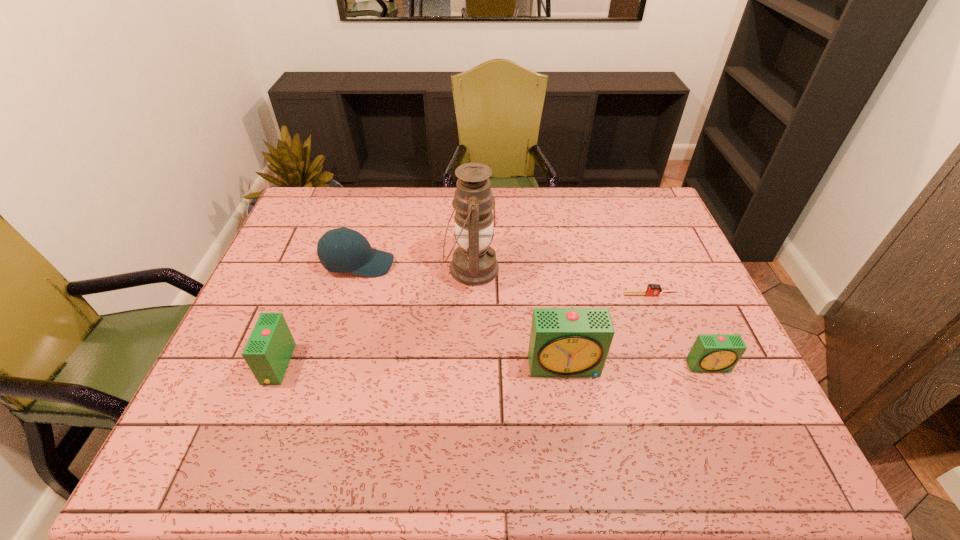
Where is `object that is at the near left corner`? This screenshot has height=540, width=960. object that is at the near left corner is located at coordinates (268, 351).

Where is `vacant area at the far edge of the desktop`? vacant area at the far edge of the desktop is located at coordinates (404, 193).

Where is `vacant space at the near edge`? The width and height of the screenshot is (960, 540). vacant space at the near edge is located at coordinates (639, 395).

Where is `blank space at the right edge of the desktop`? Image resolution: width=960 pixels, height=540 pixels. blank space at the right edge of the desktop is located at coordinates (668, 305).

Locate an element on the screen. blank space at the far right corner is located at coordinates click(645, 190).

You are a GUI agent. You are given a task and a screenshot of the screen. Output one action in this format:
    pyautogui.click(x=<x>, y=<y>)
    Task: Click on the free area in between the shortest object and the rightmost alarm clock
    This screenshot has width=960, height=540.
    Given the screenshot: What is the action you would take?
    pyautogui.click(x=680, y=330)

Locate an element on the screen. The height and width of the screenshot is (540, 960). vacant space in between the tallest object and the leftmost alarm clock is located at coordinates (374, 316).

Identify the location of free spot between the second tallest object and the baseball cap. The height and width of the screenshot is (540, 960). (462, 315).

This screenshot has width=960, height=540. In order to click on blank region between the leftmost alarm clock and the baseball cap in this screenshot , I will do `click(318, 314)`.

Where is `free space between the shortest object and the third object from left to right`? The image size is (960, 540). free space between the shortest object and the third object from left to right is located at coordinates (561, 282).